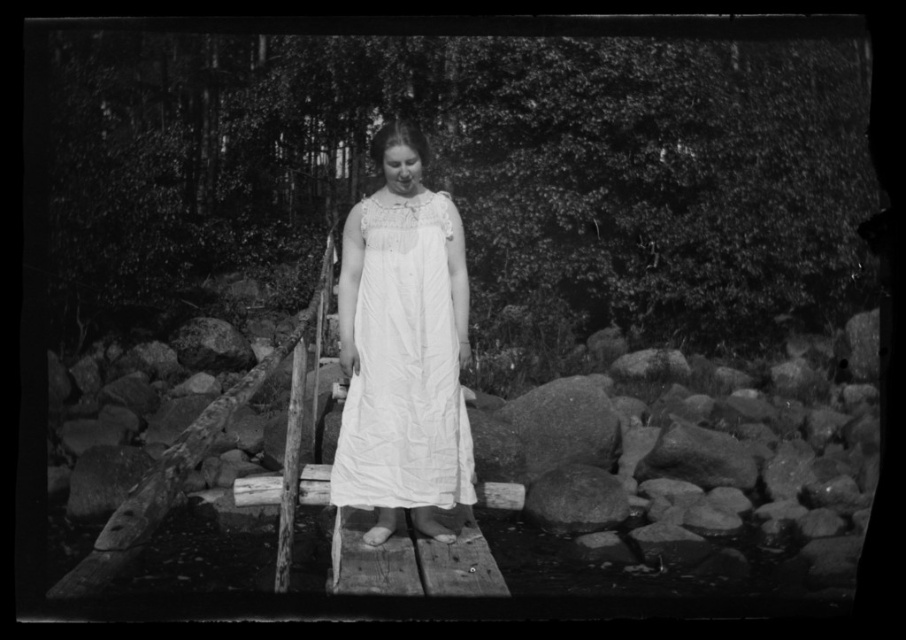
You are a photographer trying to capture the woman in her white cotton dress at center while ensuring the granite rock at center is visible in the shot. Based on their heights, which subject should you focus on first to ensure both are in the frame?

The white cotton dress at center is taller than the granite rock at center, so you should focus on the white cotton dress at center first to ensure both are in the frame.

You are a photographer planning to take a closeup shot of the white cotton dress at center and the smooth gray rock at lower center. Which object would require a wider aperture setting to ensure sharp focus on both subjects?

The smooth gray rock at lower center requires a wider aperture because it is thicker than the white cotton dress at center, which means it has more depth, necessitating a larger aperture to maintain focus on both.

You are a photographer planning to take a closeup shot of both the granite rock at center and the smooth gray rock at lower center. Given that your camera can only focus on objects within a 25 inch range, will you need to adjust your focus to capture both rocks clearly?

The granite rock at center is 27.40 inches away from the smooth gray rock at lower center. Since the distance exceeds the camera focus range of 25 inches, you will need to adjust your focus to capture both rocks clearly.